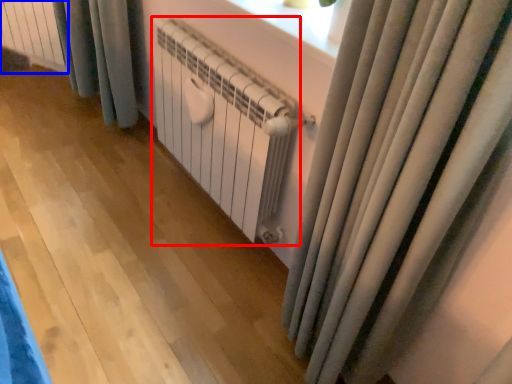
Question: Which point is closer to the camera, radiator (highlighted by a red box) or radiator (highlighted by a blue box)?

Choices:
 (A) radiator
 (B) radiator

Answer: (A)